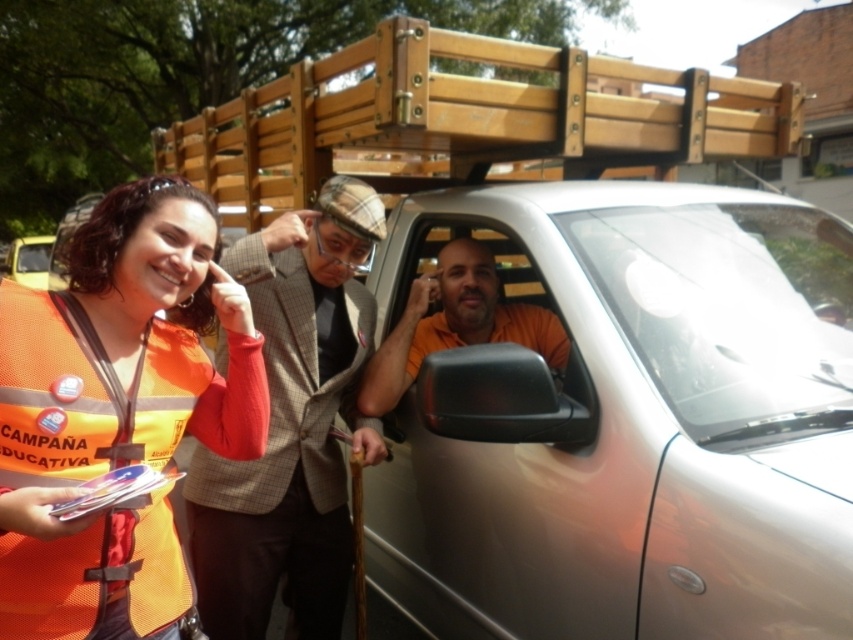
Question: Which point is farther to the camera?

Choices:
 (A) (564, 348)
 (B) (590, 545)

Answer: (A)

Question: Can you confirm if plaid fabric suit at center is positioned above metallic silver car at left?

Choices:
 (A) no
 (B) yes

Answer: (A)

Question: Considering the relative positions of silver metallic car at center and orange matte shirt at center in the image provided, where is silver metallic car at center located with respect to orange matte shirt at center?

Choices:
 (A) right
 (B) left

Answer: (A)

Question: Estimate the real-world distances between objects in this image. Which object is farther from the metallic silver car at left?

Choices:
 (A) orange reflective vest at left
 (B) orange matte shirt at center
 (C) plaid fabric suit at center
 (D) silver metallic car at center

Answer: (A)

Question: Which object appears farthest from the camera in this image?

Choices:
 (A) wooden at upper center
 (B) plaid fabric suit at center
 (C) metallic silver car at left

Answer: (C)

Question: Does silver metallic car at center appear under wooden at upper center?

Choices:
 (A) no
 (B) yes

Answer: (B)